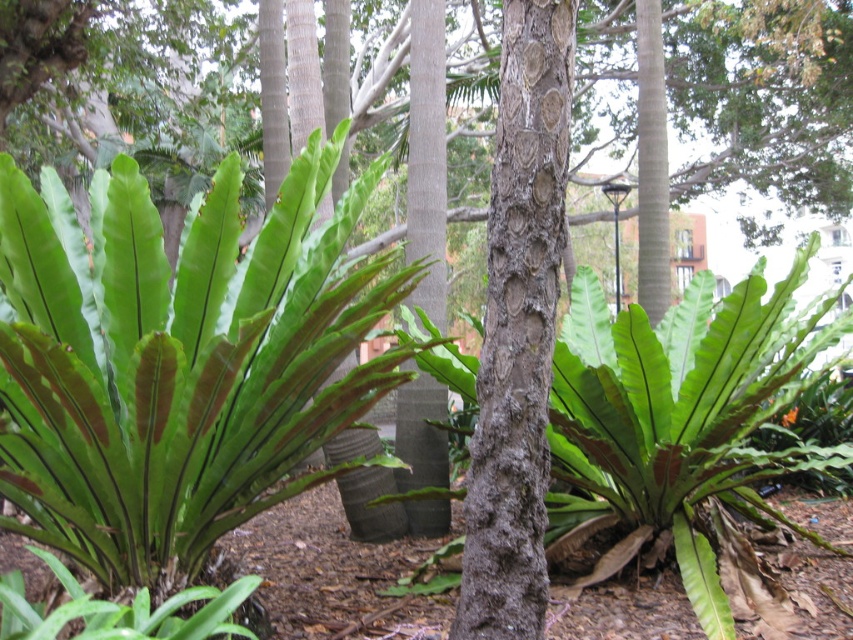
You are a gardener observing the tropical garden. You notice two ferns labeled as green matte leafy fern at center and green matte fern at center. Which fern is positioned higher in the scene?

The green matte leafy fern at center is positioned higher than the green matte fern at center.

You are standing in the tropical garden described. You want to place a small decorative statue exactly at the point marked by coordinates point (x=178, y=362). What object will the statue be placed on top of?

The point (x=178, y=362) marks the green matte leafy fern at center, so placing the statue there would put it on top of the green matte leafy fern at center.